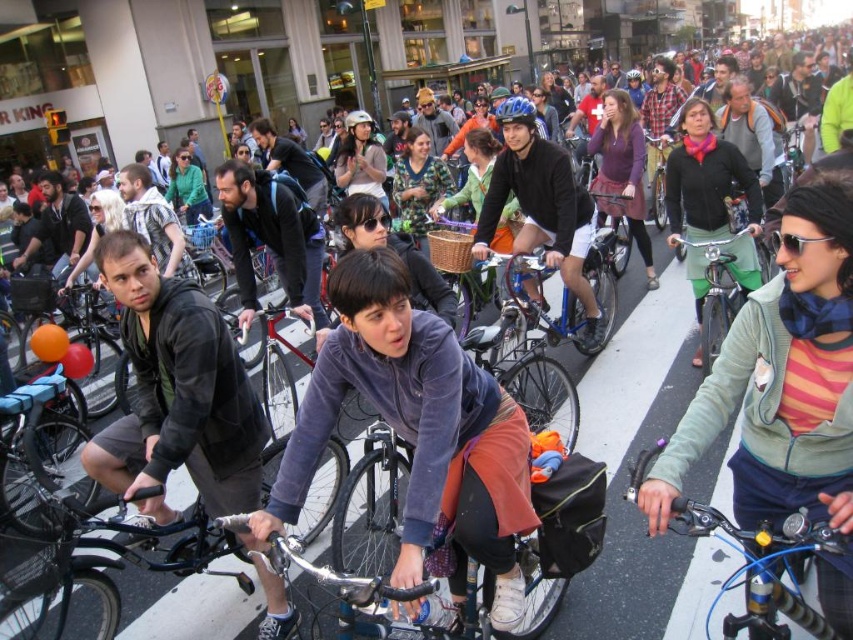
Does point (364, 387) lie behind point (489, 230)?

No, (364, 387) is in front of (489, 230).

Does velvet purple sweater at center have a lesser width compared to matte black helmet at center?

Indeed, velvet purple sweater at center has a lesser width compared to matte black helmet at center.

Is point (439, 332) positioned before point (573, 257)?

That is True.

At what (x,y) coordinates should I click in order to perform the action: click on velvet purple sweater at center. Please return your answer as a coordinate pair (x, y). The height and width of the screenshot is (640, 853). Looking at the image, I should click on (418, 436).

Does point (637, 221) lie behind point (518, 122)?

Yes, point (637, 221) is behind point (518, 122).

In the scene shown: Does matte purple sweater at center come behind matte blue helmet at center?

Yes.

Consider the image. Measure the distance between matte purple sweater at center and camera.

matte purple sweater at center and camera are 7.81 meters apart.

The width and height of the screenshot is (853, 640). In order to click on matte purple sweater at center in this screenshot , I will do `click(622, 170)`.

Does velvet purple sweater at center have a lesser height compared to green fabric skirt at center?

Indeed, velvet purple sweater at center has a lesser height compared to green fabric skirt at center.

Is velvet purple sweater at center to the right of green fabric skirt at center from the viewer's perspective?

Incorrect, velvet purple sweater at center is not on the right side of green fabric skirt at center.

Is point (508, 420) positioned before point (712, 193)?

Yes, it is.

This screenshot has height=640, width=853. I want to click on velvet purple sweater at center, so click(418, 436).